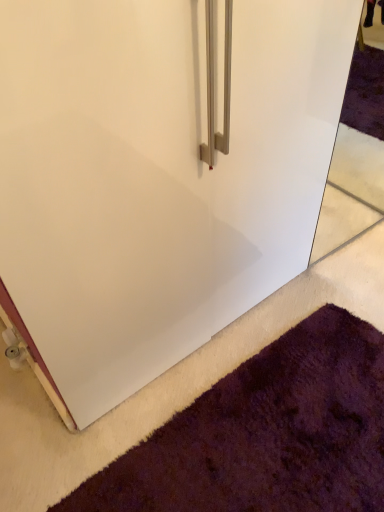
Image resolution: width=384 pixels, height=512 pixels. Find the location of `free location above purple shaggy carpet at lower right (from a real-world perspective)`. free location above purple shaggy carpet at lower right (from a real-world perspective) is located at coordinates (279, 430).